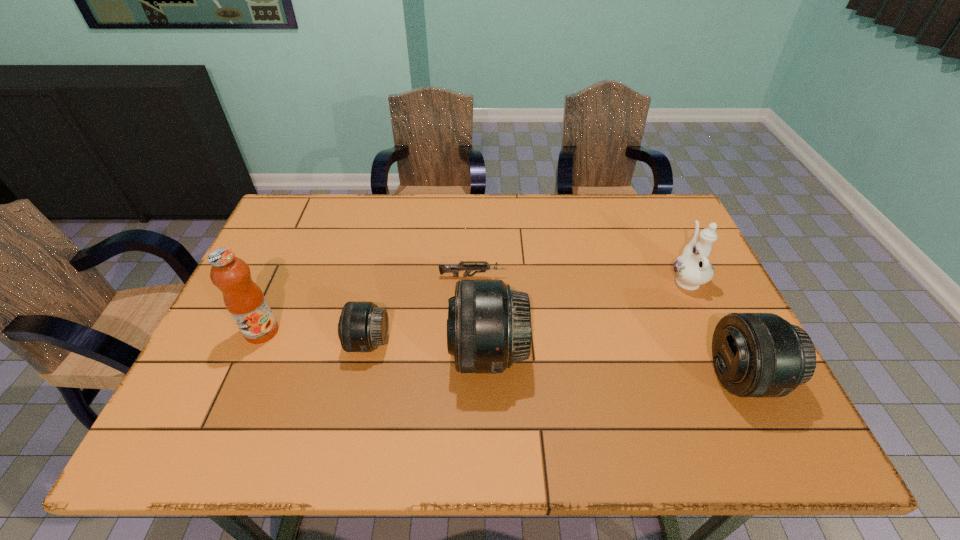
Image resolution: width=960 pixels, height=540 pixels. Find the location of `the shortest telephoto lens`. the shortest telephoto lens is located at coordinates (363, 326).

Where is `the second object from left to right`? Image resolution: width=960 pixels, height=540 pixels. the second object from left to right is located at coordinates (363, 326).

Where is `the second telephoto lens from right to left`? Image resolution: width=960 pixels, height=540 pixels. the second telephoto lens from right to left is located at coordinates (489, 325).

Where is `the fourth tallest object`? This screenshot has width=960, height=540. the fourth tallest object is located at coordinates (755, 354).

Locate an element on the screen. the rightmost telephoto lens is located at coordinates (755, 354).

I want to click on chinaware, so click(692, 269).

Find the location of `the leftmost object`. the leftmost object is located at coordinates (243, 298).

This screenshot has width=960, height=540. I want to click on the tallest object, so click(243, 298).

Find the location of a particular element. the shortest object is located at coordinates [x=454, y=269].

Where is `vacant area located 0.080m on the front-facing side of the shortest telephoto lens`? The image size is (960, 540). vacant area located 0.080m on the front-facing side of the shortest telephoto lens is located at coordinates (315, 342).